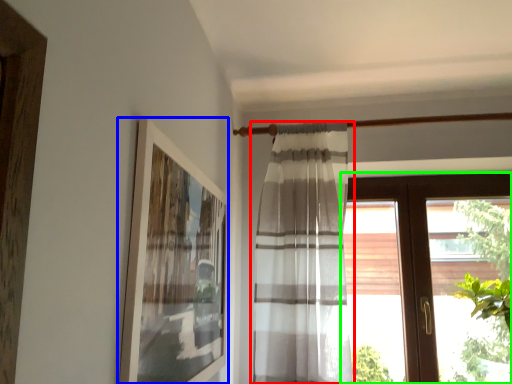
Question: Based on their relative distances, which object is nearer to curtain (highlighted by a red box)? Choose from picture frame (highlighted by a blue box) and window (highlighted by a green box).

Choices:
 (A) picture frame
 (B) window

Answer: (A)